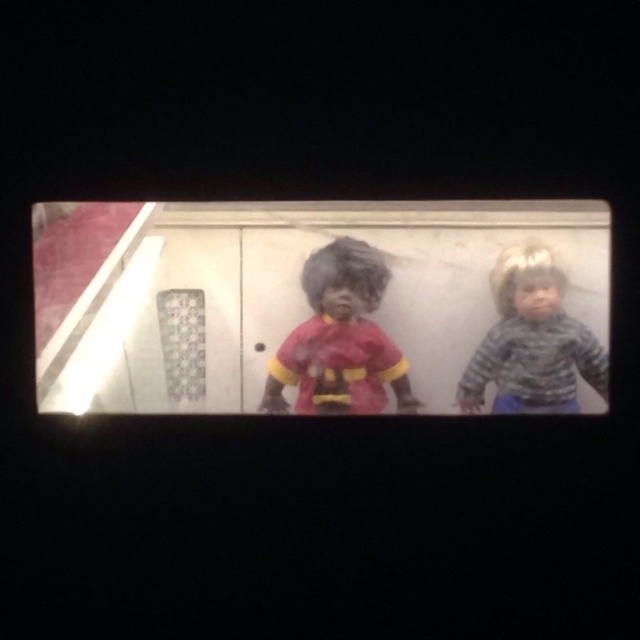
You are a costume designer preparing for a play. You need to decide which costume to adjust first based on their sizes. According to the image, which costume is larger between the matte red fabric doll at center and the camouflage sweater at right?

The matte red fabric doll at center is much taller than the camouflage sweater at right, so the costume for the matte red fabric doll at center is larger and should be adjusted first.

You are an animator checking the depth of two points in a film scene. The points are labeled as point 1 at coordinates point [332,355] and point 2 at coordinates point [548,410]. Based on the scene, which point is closer to the camera?

Point 1 at coordinates point [332,355] is closer to the camera than point 2 at coordinates point [548,410] because it is further to the viewer according to the description.

In the dimly lit scene captured in a rectangular frame, there is a point at coordinates (339, 339). What object is positioned at this exact point?

The matte red fabric doll at center is located at point (339, 339).